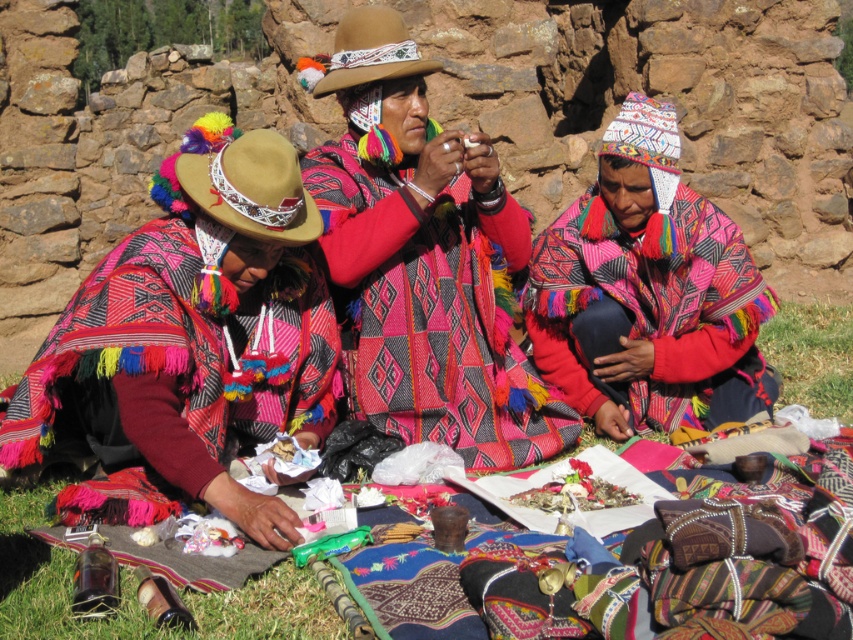
Question: Does matte pink shawl at left come behind green grass at lower right?

Choices:
 (A) no
 (B) yes

Answer: (A)

Question: Which object is closer to the camera taking this photo?

Choices:
 (A) green grass at lower right
 (B) textured wool poncho at center
 (C) matte pink shawl at left

Answer: (C)

Question: Which object appears farthest from the camera in this image?

Choices:
 (A) green grass at lower right
 (B) beaded tan cowboy hat at center

Answer: (A)

Question: Which point is closer to the camera?

Choices:
 (A) (532, 406)
 (B) (573, 278)

Answer: (A)

Question: Can you confirm if textured wool poncho at center is thinner than beaded tan cowboy hat at center?

Choices:
 (A) no
 (B) yes

Answer: (B)

Question: Is textured wool poncho at center smaller than beaded tan cowboy hat at center?

Choices:
 (A) no
 (B) yes

Answer: (B)